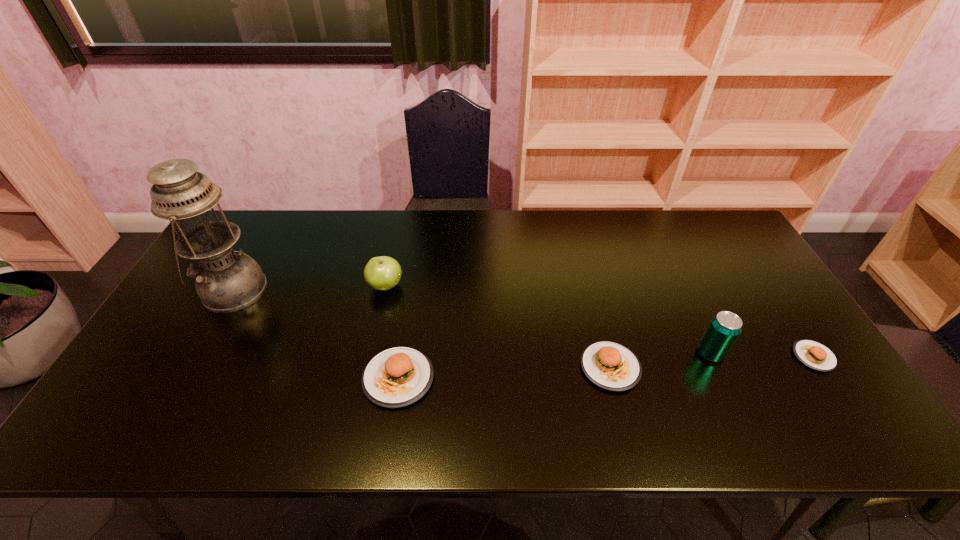
Please point a spot to add another food on the left. Please provide its 2D coordinates. Your answer should be formatted as a tuple, i.e. [(x, y)], where the tuple contains the x and y coordinates of a point satisfying the conditions above.

[(177, 390)]